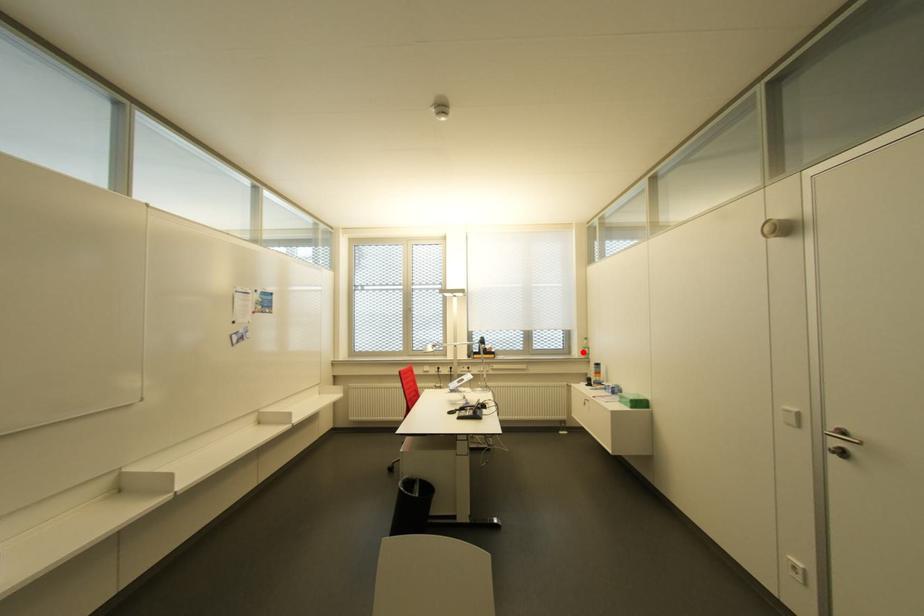
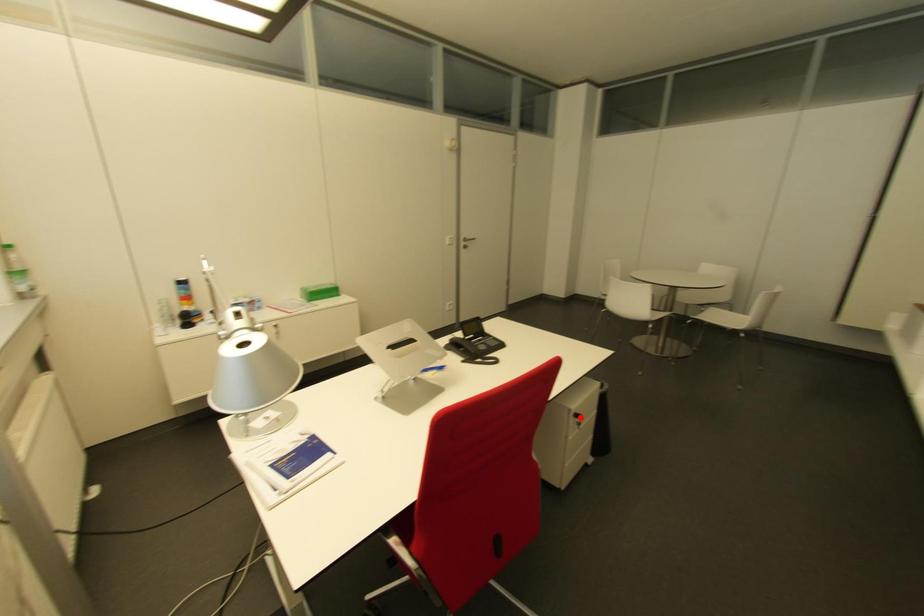
I am providing you with two images of the same scene from different viewpoints. A red point is marked on the first image and another point is marked on the second image. Do the highlighted points in image1 and image2 indicate the same real-world spot?

No